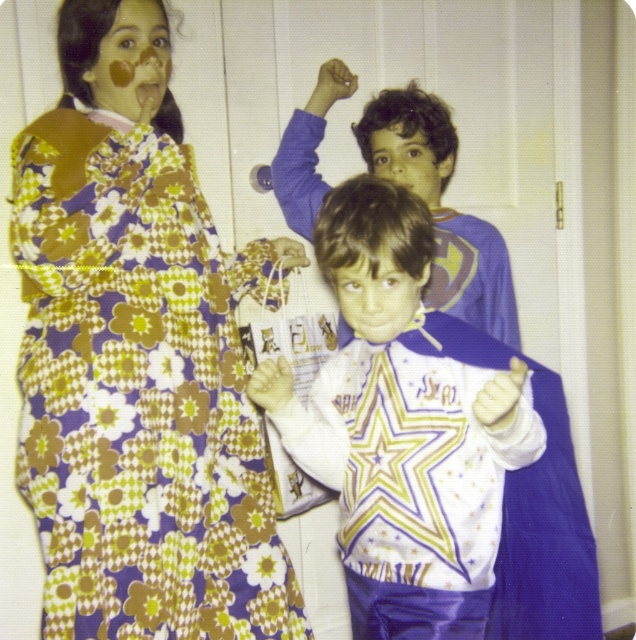
Question: Is matte brown face at upper left above smooth skin face at center?

Choices:
 (A) yes
 (B) no

Answer: (A)

Question: Among these objects, which one is farthest from the camera?

Choices:
 (A) smooth white shirt at center
 (B) floral fabric dress at upper left
 (C) matte brown face at upper left
 (D) white satin star at center

Answer: (C)

Question: Does floral fabric dress at upper left come in front of white satin star at center?

Choices:
 (A) no
 (B) yes

Answer: (A)

Question: Among these objects, which one is farthest from the camera?

Choices:
 (A) white satin star at center
 (B) matte brown face at upper left
 (C) floral fabric dress at upper left
 (D) smooth skin face at center

Answer: (D)

Question: Based on their relative distances, which object is nearer to the smooth white shirt at center?

Choices:
 (A) matte brown face at upper left
 (B) smooth skin face at center
 (C) floral fabric dress at upper left
 (D) white satin star at center

Answer: (D)

Question: Is white satin star at center below smooth skin face at center?

Choices:
 (A) yes
 (B) no

Answer: (A)